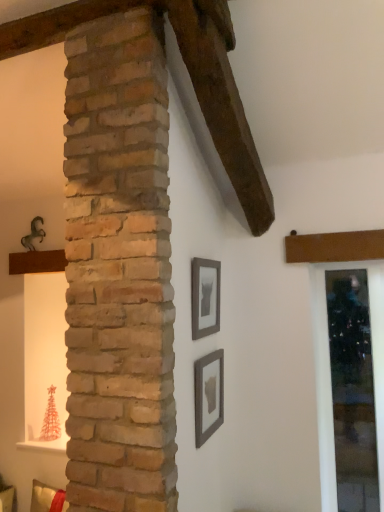
Question: Is clear glass door at right completely or partially inside matte gray picture frame at lower center, the second picture frame viewed from the top?

Choices:
 (A) no
 (B) yes

Answer: (A)

Question: Is matte gray picture frame at lower center, the second picture frame viewed from the top, outside of clear glass door at right?

Choices:
 (A) no
 (B) yes

Answer: (B)

Question: Is matte gray picture frame at lower center, the 1th picture frame in the bottom-to-top sequence, thinner than clear glass door at right?

Choices:
 (A) yes
 (B) no

Answer: (A)

Question: Are matte gray picture frame at lower center, the 1th picture frame in the bottom-to-top sequence, and clear glass door at right beside each other?

Choices:
 (A) yes
 (B) no

Answer: (B)

Question: Is matte gray picture frame at lower center, the 1th picture frame in the bottom-to-top sequence, closer to the viewer compared to clear glass door at right?

Choices:
 (A) no
 (B) yes

Answer: (B)

Question: From a real-world perspective, is matte gray picture frame at lower center, the 1th picture frame in the bottom-to-top sequence, on top of clear glass door at right?

Choices:
 (A) yes
 (B) no

Answer: (A)

Question: Could you tell me if matte gray picture frame at lower center, the second picture frame viewed from the top, is facing matte gray picture frame at center, placed as the 1th picture frame when sorted from top to bottom?

Choices:
 (A) no
 (B) yes

Answer: (A)

Question: Does matte gray picture frame at lower center, the 1th picture frame in the bottom-to-top sequence, have a lesser height compared to matte gray picture frame at center, the second picture frame from the bottom?

Choices:
 (A) no
 (B) yes

Answer: (B)

Question: Is matte gray picture frame at lower center, the 1th picture frame in the bottom-to-top sequence, not within matte gray picture frame at center, placed as the 1th picture frame when sorted from top to bottom?

Choices:
 (A) yes
 (B) no

Answer: (A)

Question: Is matte gray picture frame at lower center, the 1th picture frame in the bottom-to-top sequence, not close to matte gray picture frame at center, placed as the 1th picture frame when sorted from top to bottom?

Choices:
 (A) yes
 (B) no

Answer: (B)

Question: Is matte gray picture frame at lower center, the second picture frame viewed from the top, positioned with its back to matte gray picture frame at center, placed as the 1th picture frame when sorted from top to bottom?

Choices:
 (A) no
 (B) yes

Answer: (A)

Question: Is the surface of matte gray picture frame at lower center, the 1th picture frame in the bottom-to-top sequence, in direct contact with matte gray picture frame at center, placed as the 1th picture frame when sorted from top to bottom?

Choices:
 (A) no
 (B) yes

Answer: (A)

Question: Is clear glass door at right bigger than matte gray picture frame at center, placed as the 1th picture frame when sorted from top to bottom?

Choices:
 (A) yes
 (B) no

Answer: (A)